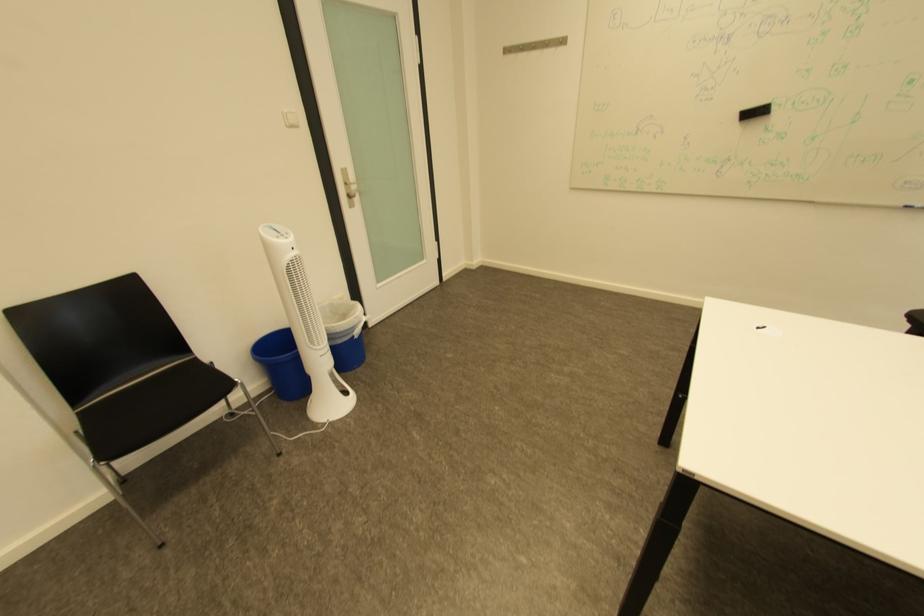
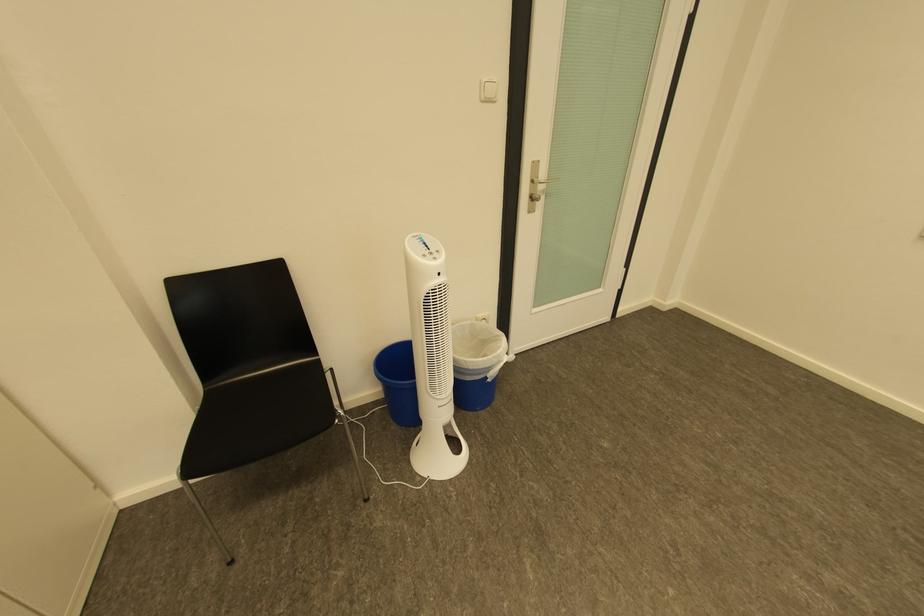
Find the pixel in the second image that matches point 86,413 in the first image.

(215, 389)